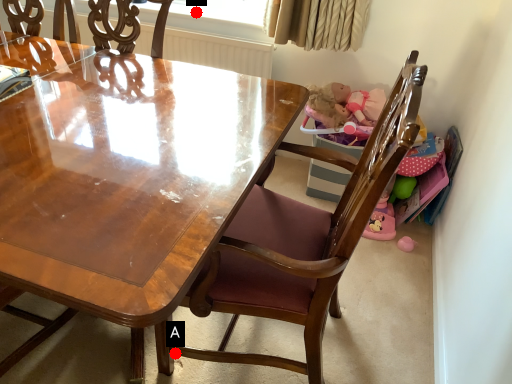
Question: Two points are circled on the image, labeled by A and B beside each circle. Which point is closer to the camera taking this photo?

Choices:
 (A) A is closer
 (B) B is closer

Answer: (A)